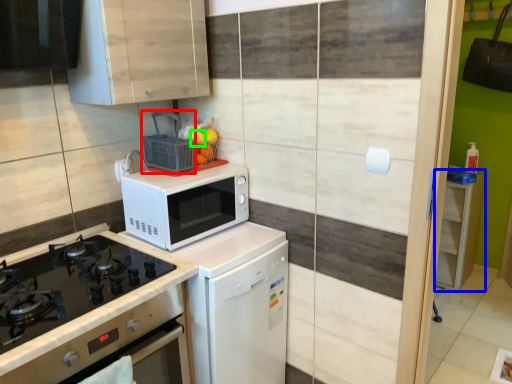
Question: Which object is the closest to the basket (highlighted by a red box)? Choose among these: cabinetry (highlighted by a blue box) or orange (highlighted by a green box).

Choices:
 (A) cabinetry
 (B) orange

Answer: (B)